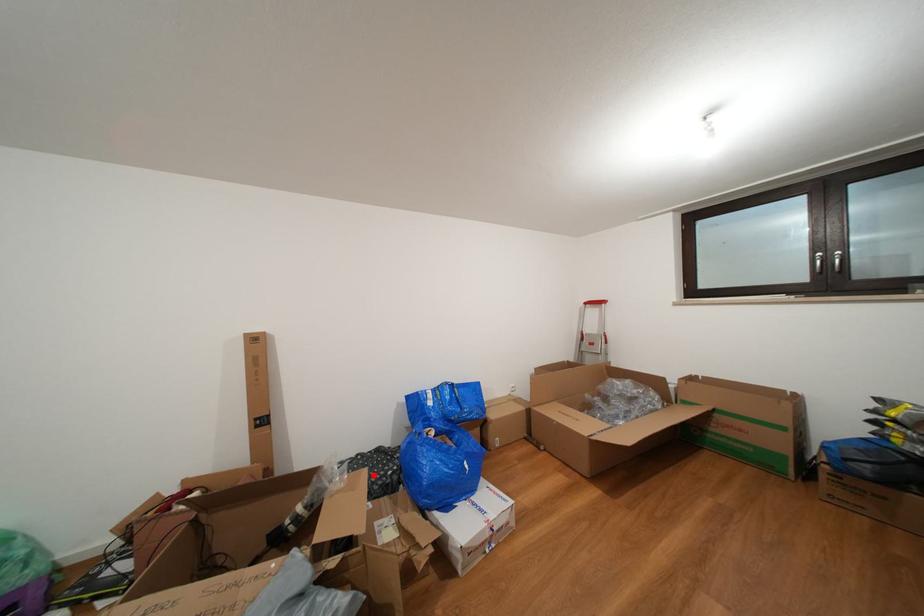
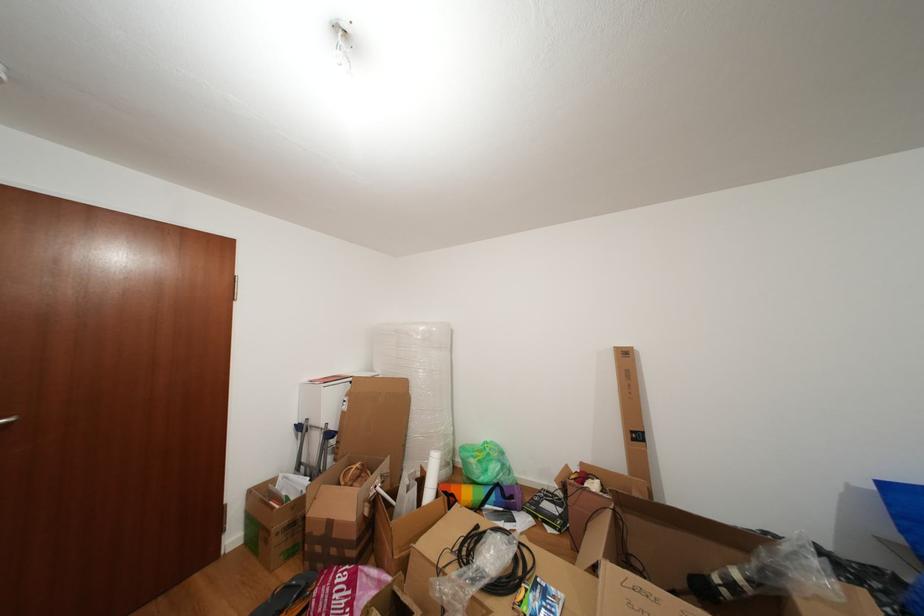
Find the pixel in the second image that matches the highlighted location in the first image.

(871, 598)